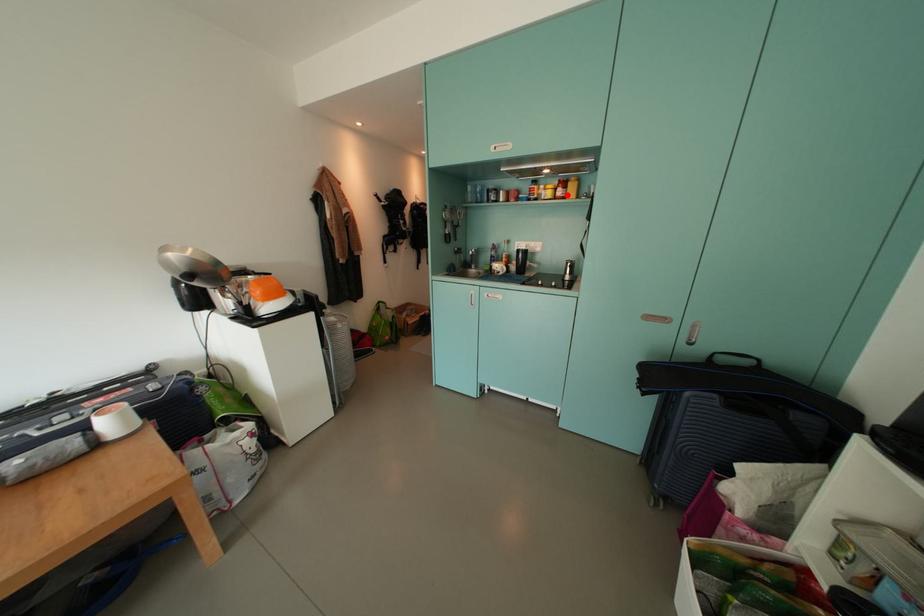
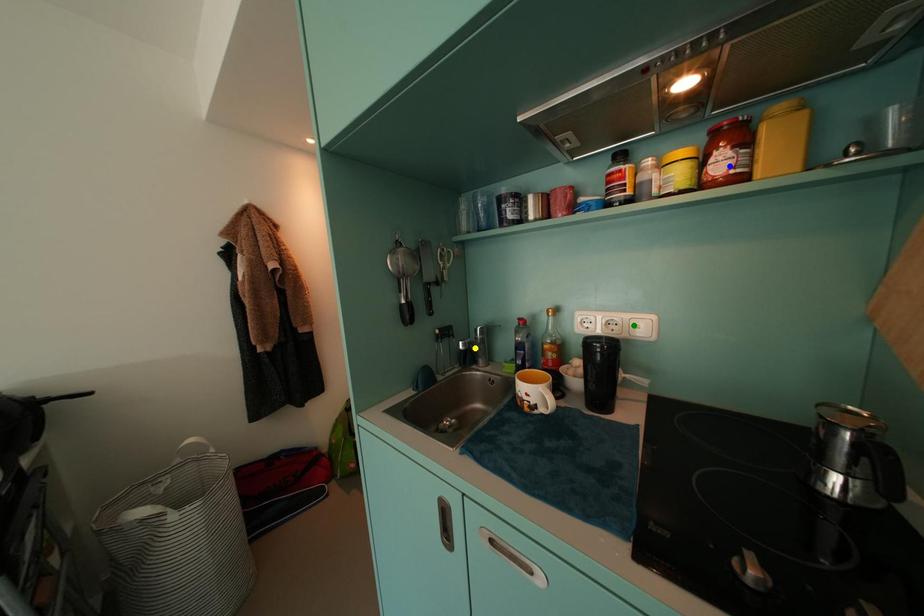
Question: I am providing you with two images of the same scene from different viewpoints. A red point is marked on the first image. You are given multiple points on the second image. Can you choose the point in image 2 that corresponds to the point in image 1?

Choices:
 (A) blue point
 (B) green point
 (C) yellow point

Answer: (A)